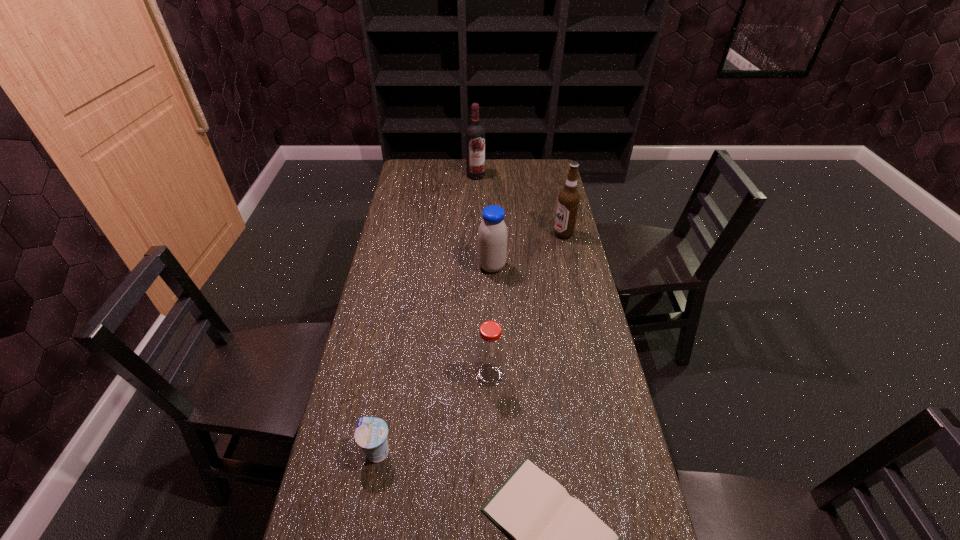
You are a GUI agent. You are given a task and a screenshot of the screen. Output one action in this format:
    pyautogui.click(x=<x>, y=<y>)
    Task: Click on the free location at the right edge of the desktop
    The width and height of the screenshot is (960, 540).
    Given the screenshot: What is the action you would take?
    pyautogui.click(x=544, y=267)

The image size is (960, 540). Identify the location of vacant space at the far left corner. pyautogui.click(x=429, y=161).

I want to click on free spot between the fourth nearest object and the alcohol, so click(x=528, y=251).

Where is `vacant area that lies between the fifth tallest object and the fifth nearest object`? The width and height of the screenshot is (960, 540). vacant area that lies between the fifth tallest object and the fifth nearest object is located at coordinates pyautogui.click(x=470, y=343).

You are a GUI agent. You are given a task and a screenshot of the screen. Output one action in this format:
    pyautogui.click(x=<x>, y=<y>)
    Task: Click on the free point between the leftmost object and the alcohol
    This screenshot has width=960, height=540.
    Given the screenshot: What is the action you would take?
    pyautogui.click(x=470, y=343)

Locate an element on the screen. empty space that is in between the fourth tallest object and the soya milk is located at coordinates (491, 321).

Locate an element on the screen. The image size is (960, 540). free space between the fifth nearest object and the wine bottle is located at coordinates (519, 205).

Where is `free spot between the yogurt and the third farthest object`? free spot between the yogurt and the third farthest object is located at coordinates (435, 359).

The image size is (960, 540). I want to click on empty space between the yogurt and the wine bottle, so click(x=427, y=314).

Identify which object is the fourth closest to the second farthest object. Please provide its 2D coordinates. Your answer should be formatted as a tuple, i.e. [(x, y)], where the tuple contains the x and y coordinates of a point satisfying the conditions above.

[(555, 539)]